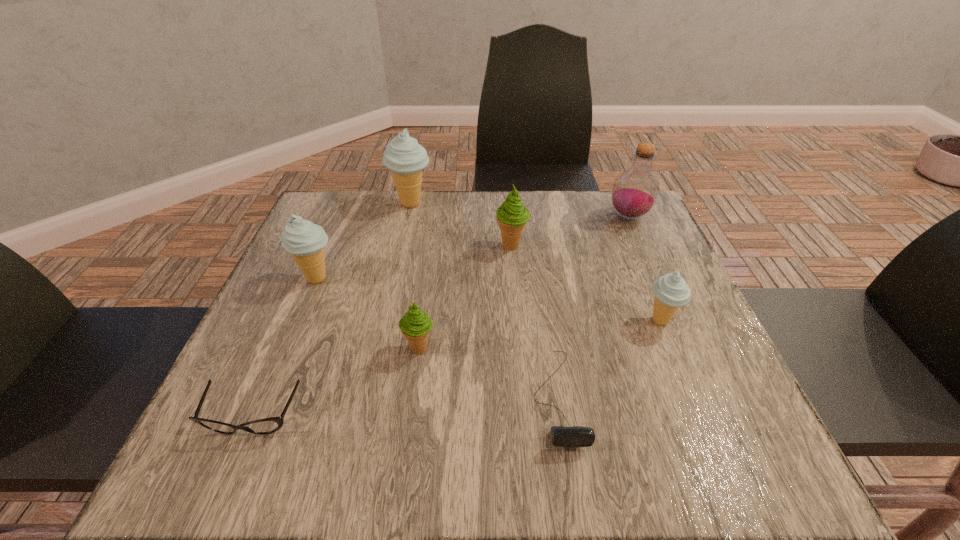
Find the location of a particular element. free space between the spectacles and the second beige icecream from left to right is located at coordinates (332, 310).

This screenshot has height=540, width=960. In order to click on unoccupied position between the biggest beige icecream and the smaller green icecream in this screenshot , I will do `click(416, 276)`.

The image size is (960, 540). Find the location of `empty location between the black spectacles and the second biggest beige icecream`. empty location between the black spectacles and the second biggest beige icecream is located at coordinates (285, 348).

Find the location of a particular element. Image resolution: width=960 pixels, height=540 pixels. object that is the seventh closest one to the webcam is located at coordinates (404, 157).

At what (x,y) coordinates should I click in order to perform the action: click on object that is the third closest to the nearest beige icecream. Please return your answer as a coordinate pair (x, y). Looking at the image, I should click on (635, 191).

Find the location of `the fourth closest icecream relative to the farthest beige icecream`. the fourth closest icecream relative to the farthest beige icecream is located at coordinates (671, 291).

Identify the location of the third closest icecream to the right green icecream. (415, 325).

This screenshot has height=540, width=960. What are the coordinates of `beige icecream that can be found as the third closest to the black spectacles` in the screenshot? It's located at (671, 291).

The image size is (960, 540). Find the location of `the closest beige icecream relative to the nearer green icecream`. the closest beige icecream relative to the nearer green icecream is located at coordinates (305, 241).

The width and height of the screenshot is (960, 540). I want to click on vacant region that satisfies the following two spatial constraints: 1. on the front side of the nearer green icecream; 2. on the left side of the farthest icecream, so click(380, 348).